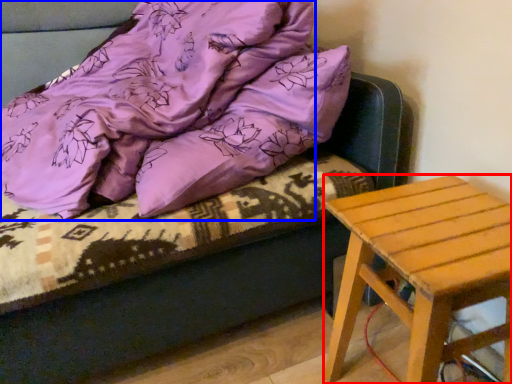
Question: Which object is further to the camera taking this photo, stool (highlighted by a red box) or blanket (highlighted by a blue box)?

Choices:
 (A) stool
 (B) blanket

Answer: (A)